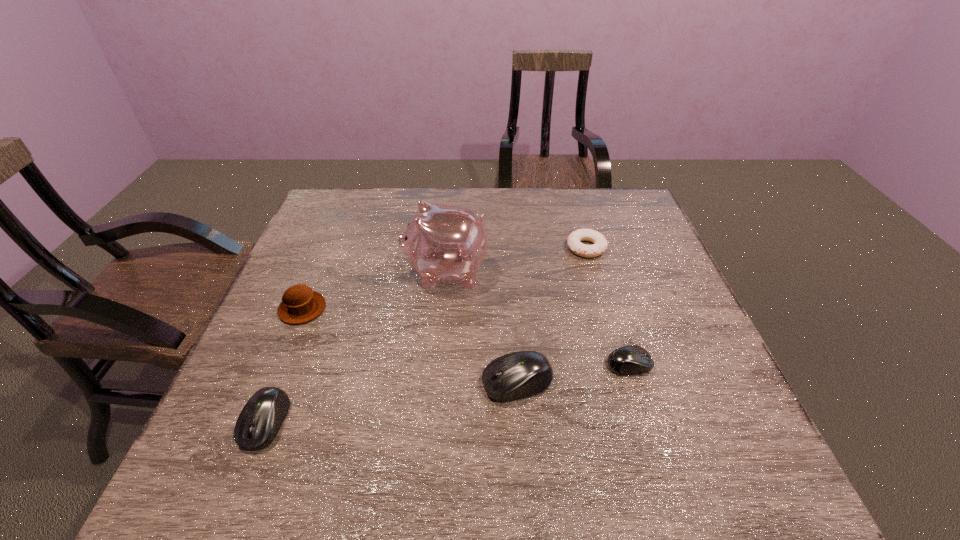
To achieve uniform spacing by inserting another mouse_(computer_equipment) among them, please point to a free space for this new mouse_(computer_equipment). Please provide its 2D coordinates. Your answer should be formatted as a tuple, i.e. [(x, y)], where the tuple contains the x and y coordinates of a point satisfying the conditions above.

[(396, 402)]